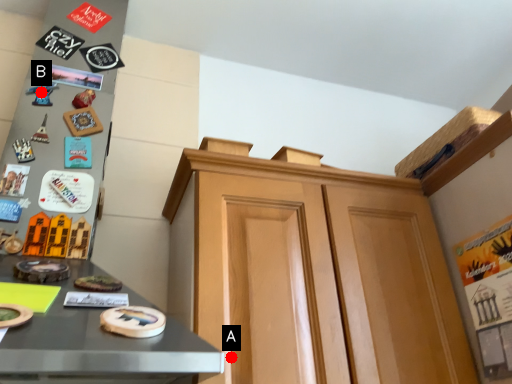
Question: Two points are circled on the image, labeled by A and B beside each circle. Which point is farther to the camera?

Choices:
 (A) A is further
 (B) B is further

Answer: (B)